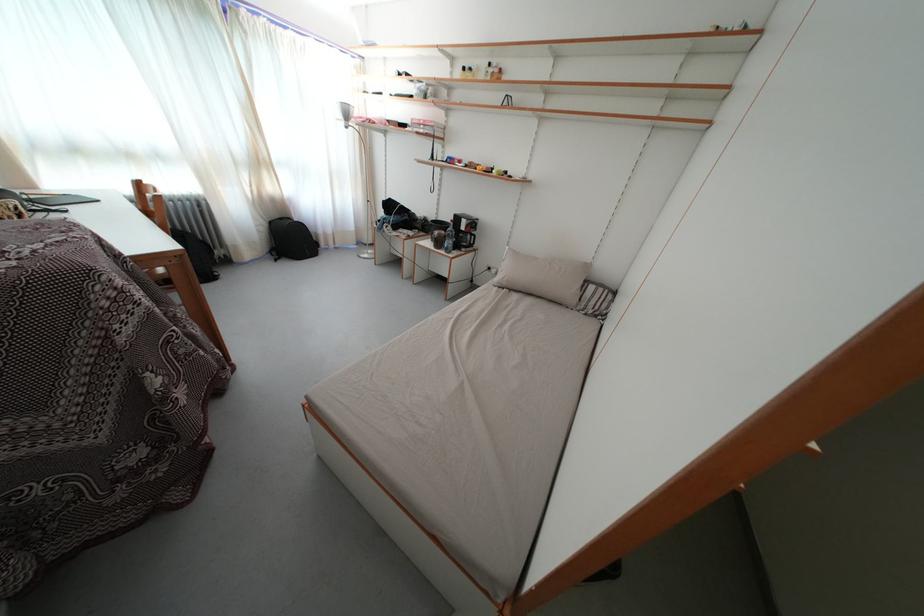
Which object does [448,238] point to?

This point indicates the clear water bottle.